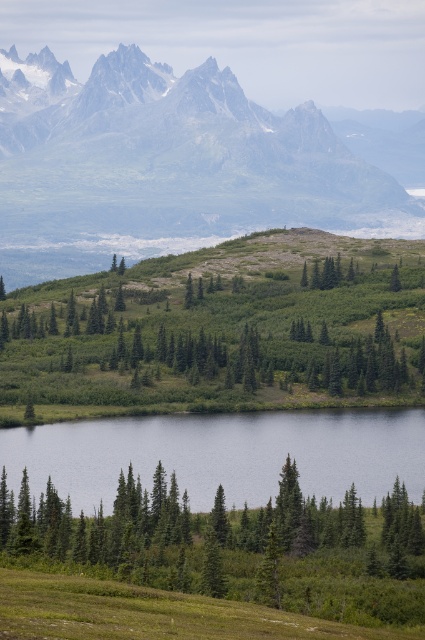
Is green matte tree at center taller than green matte tree at lower left?

Correct, green matte tree at center is much taller as green matte tree at lower left.

Between green matte tree at center and green matte tree at lower left, which one appears on the right side from the viewer's perspective?

Positioned to the right is green matte tree at lower left.

Does point (370, 264) lie in front of point (282, 528)?

No, it is behind (282, 528).

Where is `green matte tree at center`? green matte tree at center is located at coordinates (223, 330).

Can you confirm if green matte tree at center is shorter than gray rocky mountain range at upper left?

Indeed, green matte tree at center has a lesser height compared to gray rocky mountain range at upper left.

Is green matte tree at center behind gray rocky mountain range at upper left?

No, it is not.

I want to click on green matte tree at center, so click(x=223, y=330).

From the picture: Does green matte tree at center appear on the left side of smooth reflective water at lower center?

Indeed, green matte tree at center is positioned on the left side of smooth reflective water at lower center.

Which of these two, green matte tree at center or smooth reflective water at lower center, stands taller?

green matte tree at center is taller.

At what (x,y) coordinates should I click in order to perform the action: click on green matte tree at center. Please return your answer as a coordinate pair (x, y). Looking at the image, I should click on (223, 330).